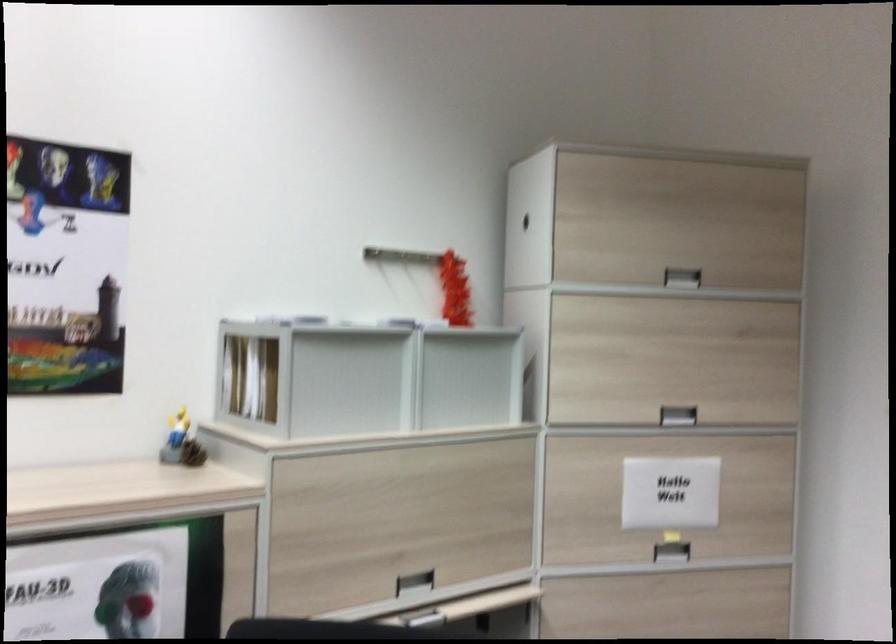
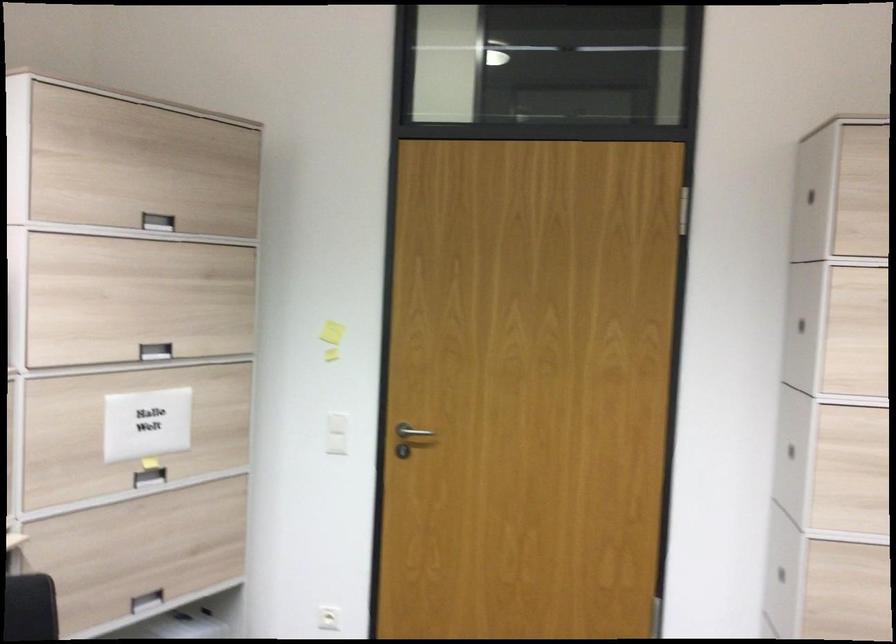
Question: Based on the continuous images, in which direction is the camera rotating? Reply with the corresponding letter.

Choices:
 (A) Left
 (B) Right
 (C) Up
 (D) Down

Answer: (B)